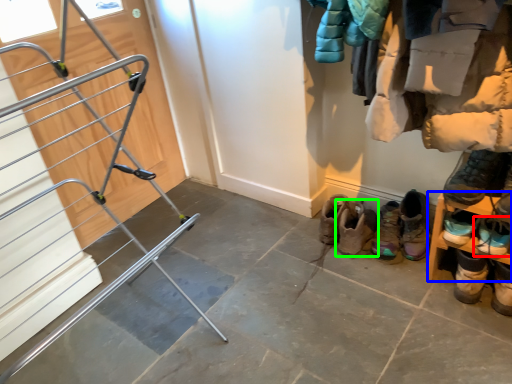
Question: Estimate the real-world distances between objects in this image. Which object is farther from footwear (highlighted by a red box), shelf (highlighted by a blue box) or footwear (highlighted by a green box)?

Choices:
 (A) shelf
 (B) footwear

Answer: (B)